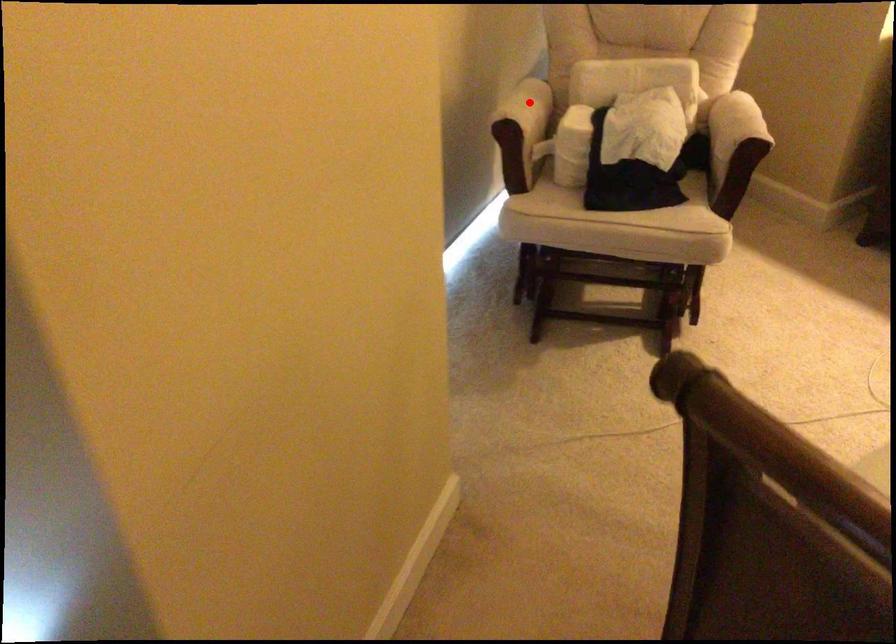
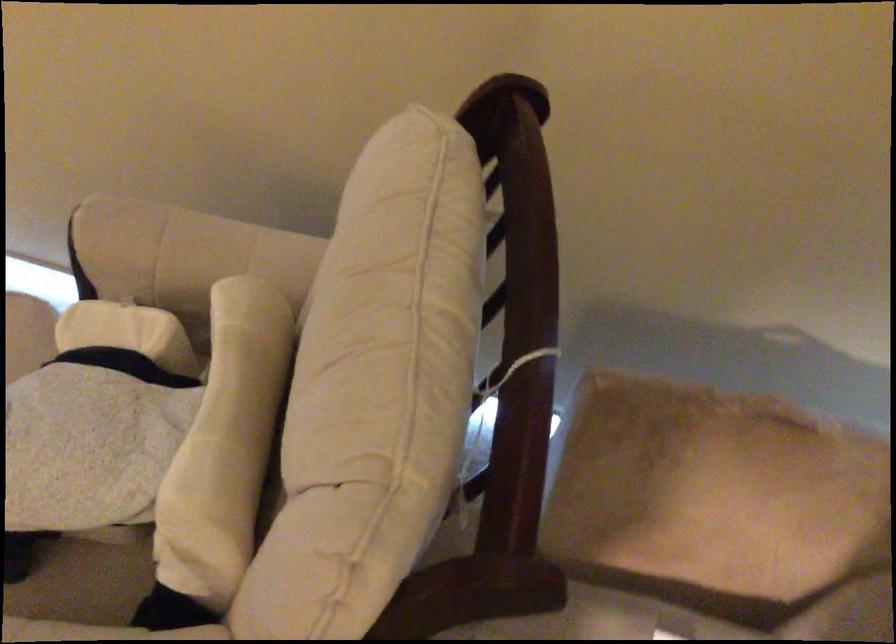
Question: I am providing you with two images of the same scene from different viewpoints. Image1 has a red point marked. In image2, the corresponding 3D location appears at what relative position? Reply with the corresponding letter.

Choices:
 (A) Closer
 (B) Farther

Answer: (A)